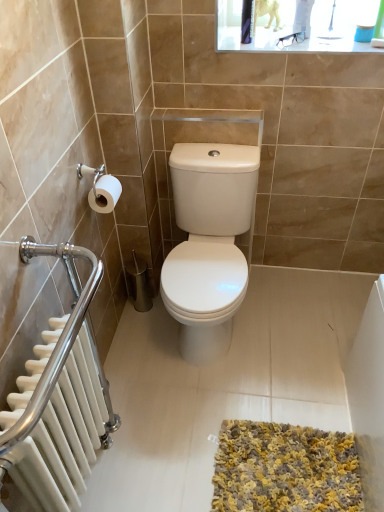
Where is `yellow-grey shaggy bath mat at lower center`? yellow-grey shaggy bath mat at lower center is located at coordinates (285, 469).

The width and height of the screenshot is (384, 512). I want to click on white metallic radiator at left, so click(x=64, y=435).

The height and width of the screenshot is (512, 384). I want to click on yellow-grey shaggy bath mat at lower center, so click(x=285, y=469).

Are yellow-grey shaggy bath mat at lower center and white metallic radiator at left making contact?

No, yellow-grey shaggy bath mat at lower center is not making contact with white metallic radiator at left.

From a real-world perspective, is yellow-grey shaggy bath mat at lower center above or below white metallic radiator at left?

Clearly, from a real-world perspective, yellow-grey shaggy bath mat at lower center is below white metallic radiator at left.

Does yellow-grey shaggy bath mat at lower center have a lesser width compared to white metallic radiator at left?

No, yellow-grey shaggy bath mat at lower center is not thinner than white metallic radiator at left.

Is yellow-grey shaggy bath mat at lower center completely or partially outside of white metallic radiator at left?

yellow-grey shaggy bath mat at lower center is positioned outside white metallic radiator at left.

Is white matte toilet paper at left turned away from white metallic radiator at left?

No, white matte toilet paper at left is not facing away from white metallic radiator at left.

Is white matte toilet paper at left at the right side of white metallic radiator at left?

Indeed, white matte toilet paper at left is positioned on the right side of white metallic radiator at left.

Where is `radiator below the white matte toilet paper at left (from the image's perspective)`? Image resolution: width=384 pixels, height=512 pixels. radiator below the white matte toilet paper at left (from the image's perspective) is located at coordinates (64, 435).

Does yellow-grey shaggy bath mat at lower center appear on the left side of white matte toilet paper at left?

No.

How different are the orientations of yellow-grey shaggy bath mat at lower center and white matte toilet paper at left in degrees?

There is a 89.8-degree angle between the facing directions of yellow-grey shaggy bath mat at lower center and white matte toilet paper at left.

In terms of width, does yellow-grey shaggy bath mat at lower center look wider or thinner when compared to white matte toilet paper at left?

yellow-grey shaggy bath mat at lower center is wider than white matte toilet paper at left.

This screenshot has height=512, width=384. What are the coordinates of `toilet paper on the left of yellow-grey shaggy bath mat at lower center` in the screenshot? It's located at (104, 194).

From a real-world perspective, is white metallic radiator at left under white matte toilet paper at left?

Yes, from a real-world perspective, white metallic radiator at left is under white matte toilet paper at left.

From the image's perspective, is white metallic radiator at left under white matte toilet paper at left?

Yes, from the image's perspective, white metallic radiator at left is beneath white matte toilet paper at left.

Is white metallic radiator at left to the left or to the right of white matte toilet paper at left in the image?

Clearly, white metallic radiator at left is on the left of white matte toilet paper at left in the image.

Is white matte toilet paper at left spatially inside yellow-grey shaggy bath mat at lower center, or outside of it?

white matte toilet paper at left cannot be found inside yellow-grey shaggy bath mat at lower center.

In terms of height, does white matte toilet paper at left look taller or shorter compared to yellow-grey shaggy bath mat at lower center?

Clearly, white matte toilet paper at left is taller compared to yellow-grey shaggy bath mat at lower center.

Does white matte toilet paper at left have a greater width compared to yellow-grey shaggy bath mat at lower center?

No, white matte toilet paper at left is not wider than yellow-grey shaggy bath mat at lower center.

Considering the positions of points (116, 191) and (268, 502), is point (116, 191) farther from camera compared to point (268, 502)?

Yes, point (116, 191) is behind point (268, 502).

Can you confirm if white metallic radiator at left is thinner than yellow-grey shaggy bath mat at lower center?

Yes, white metallic radiator at left is thinner than yellow-grey shaggy bath mat at lower center.

Is white metallic radiator at left not close to yellow-grey shaggy bath mat at lower center?

No, white metallic radiator at left is in close proximity to yellow-grey shaggy bath mat at lower center.

From the image's perspective, does white metallic radiator at left appear lower than yellow-grey shaggy bath mat at lower center?

Incorrect, from the image's perspective, white metallic radiator at left is higher than yellow-grey shaggy bath mat at lower center.

Considering the points (58, 398) and (300, 468), which point is behind, point (58, 398) or point (300, 468)?

The point (300, 468) is farther.

The width and height of the screenshot is (384, 512). I want to click on radiator on the left of yellow-grey shaggy bath mat at lower center, so click(64, 435).

Locate an element on the screen. The image size is (384, 512). radiator below the white matte toilet paper at left (from a real-world perspective) is located at coordinates (64, 435).

Looking at the image, which one is located further to yellow-grey shaggy bath mat at lower center, white metallic radiator at left or white matte toilet paper at left?

white matte toilet paper at left is positioned further to the anchor yellow-grey shaggy bath mat at lower center.

When comparing their distances from white matte toilet paper at left, does white metallic radiator at left or yellow-grey shaggy bath mat at lower center seem closer?

white metallic radiator at left is positioned closer to the anchor white matte toilet paper at left.

Looking at the image, which one is located further to yellow-grey shaggy bath mat at lower center, white matte toilet paper at left or white metallic radiator at left?

Based on the image, white matte toilet paper at left appears to be further to yellow-grey shaggy bath mat at lower center.

Estimate the real-world distances between objects in this image. Which object is closer to white matte toilet paper at left, yellow-grey shaggy bath mat at lower center or white metallic radiator at left?

white metallic radiator at left lies closer to white matte toilet paper at left than the other object.

Considering their positions, is white matte toilet paper at left positioned further to white metallic radiator at left than yellow-grey shaggy bath mat at lower center?

Among the two, white matte toilet paper at left is located further to white metallic radiator at left.

Looking at the image, which one is located closer to white metallic radiator at left, yellow-grey shaggy bath mat at lower center or white matte toilet paper at left?

The object closer to white metallic radiator at left is yellow-grey shaggy bath mat at lower center.

Where is `radiator between white matte toilet paper at left and yellow-grey shaggy bath mat at lower center in the up-down direction`? radiator between white matte toilet paper at left and yellow-grey shaggy bath mat at lower center in the up-down direction is located at coordinates (64, 435).